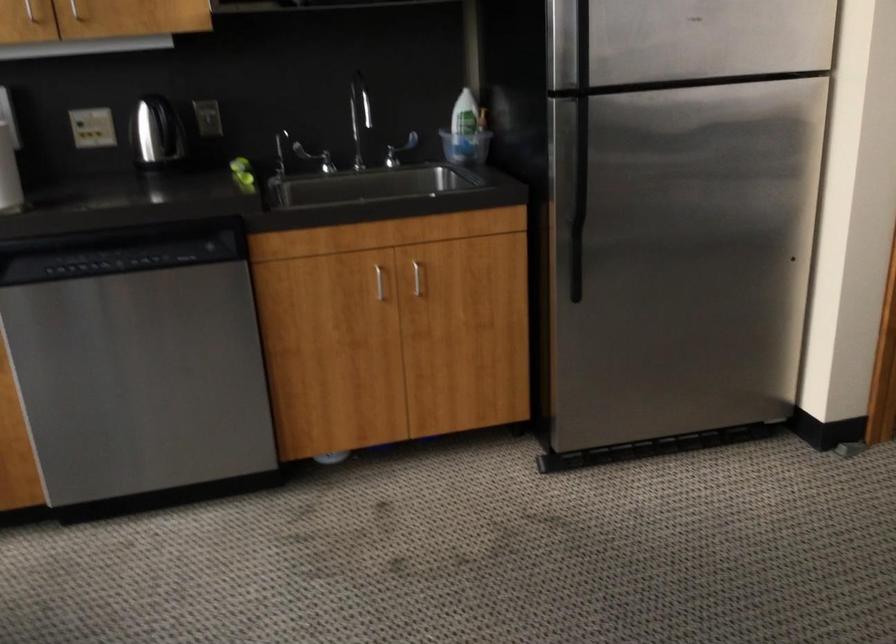
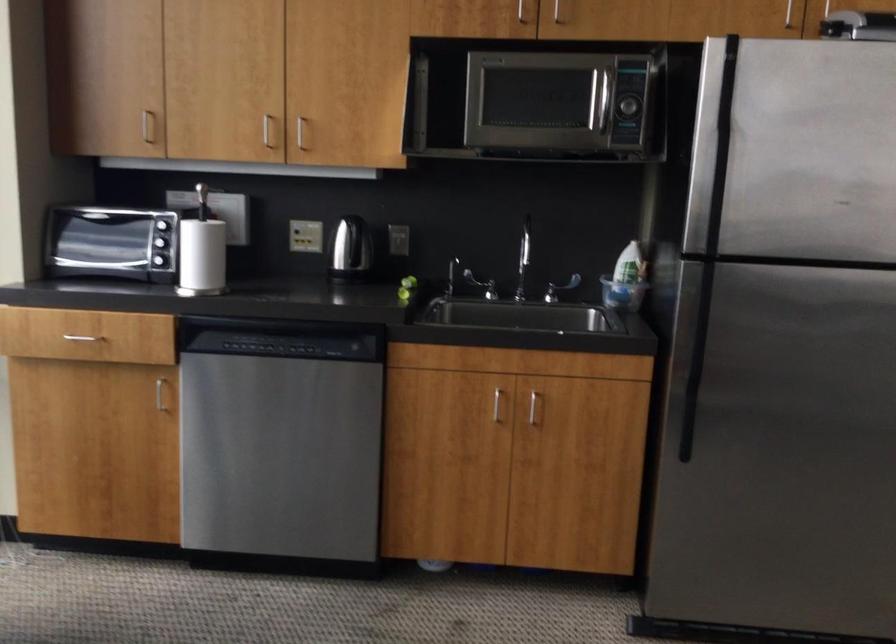
Locate, in the second image, the point that corresponds to point 464,145 in the first image.

(622, 294)